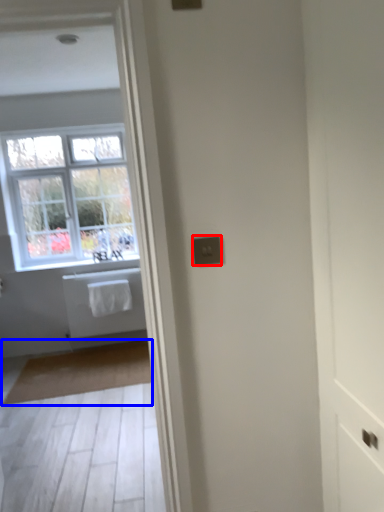
Question: Which object is further to the camera taking this photo, electric outlet (highlighted by a red box) or mat (highlighted by a blue box)?

Choices:
 (A) electric outlet
 (B) mat

Answer: (B)